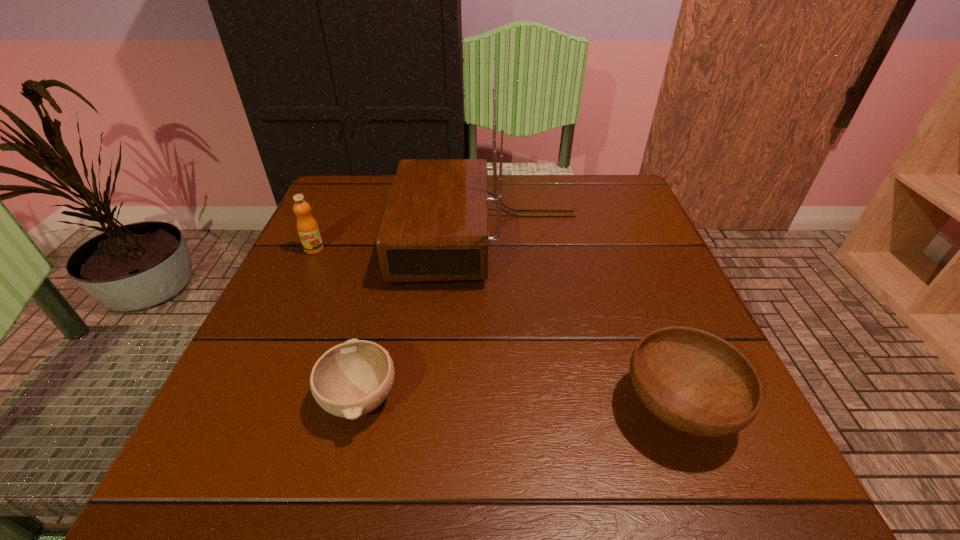
The image size is (960, 540). In order to click on free space located on the front label of the second tallest object in this screenshot , I will do `click(269, 345)`.

At what (x,y) coordinates should I click in order to perform the action: click on free space located 0.230m on the back of the second shortest object. Please return your answer as a coordinate pair (x, y). The height and width of the screenshot is (540, 960). Looking at the image, I should click on (626, 272).

Where is `free space located on the back of the shorter bowl`? This screenshot has width=960, height=540. free space located on the back of the shorter bowl is located at coordinates (377, 325).

At what (x,y) coordinates should I click in order to perform the action: click on object that is positioned at the far edge. Please return your answer as a coordinate pair (x, y). The image size is (960, 540). Looking at the image, I should click on (435, 228).

Find the location of a particular element. orange juice that is positioned at the left edge is located at coordinates (307, 227).

This screenshot has width=960, height=540. I want to click on bowl located in the left edge section of the desktop, so click(x=351, y=379).

Find the location of a particular element. The width and height of the screenshot is (960, 540). object that is at the right edge is located at coordinates (694, 381).

You are a GUI agent. You are given a task and a screenshot of the screen. Output one action in this format:
    pyautogui.click(x=<x>, y=<y>)
    Task: Click on the object at the near left corner
    The height and width of the screenshot is (540, 960).
    Given the screenshot: What is the action you would take?
    pyautogui.click(x=351, y=379)

What are the coordinates of `object present at the near right corner` in the screenshot? It's located at (694, 381).

You are a GUI agent. You are given a task and a screenshot of the screen. Output one action in this format:
    pyautogui.click(x=<x>, y=<y>)
    Task: Click on the vacant space at the far edge of the desktop
    The image size is (960, 540).
    Given the screenshot: What is the action you would take?
    pyautogui.click(x=492, y=181)